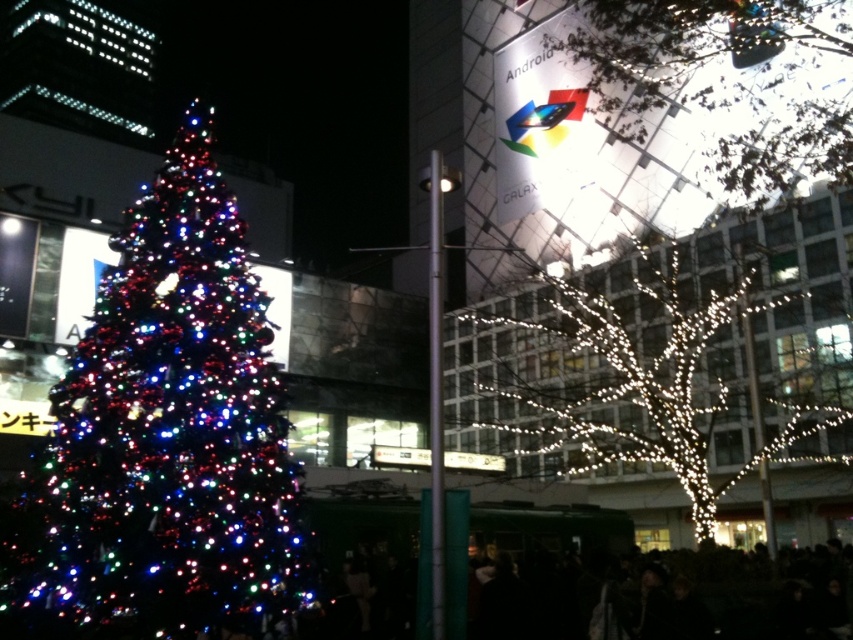
Can you confirm if multicolored lights at left is wider than illuminated wire at upper right?

Indeed, multicolored lights at left has a greater width compared to illuminated wire at upper right.

Where is `multicolored lights at left`? Image resolution: width=853 pixels, height=640 pixels. multicolored lights at left is located at coordinates (166, 435).

Is point (759, 356) in front of point (775, 8)?

That is False.

Is point (752, 458) more distant than point (795, 128)?

No, it is not.

Is point (744, 259) positioned behind point (672, 60)?

No.

At what (x,y) coordinates should I click in order to perform the action: click on illuminated wire at right. Please return your answer as a coordinate pair (x, y). Looking at the image, I should click on (668, 362).

Image resolution: width=853 pixels, height=640 pixels. What do you see at coordinates (166, 435) in the screenshot?
I see `multicolored lights at left` at bounding box center [166, 435].

Who is more forward, [254,413] or [759,364]?

Point [254,413]

Identify the location of multicolored lights at left. This screenshot has height=640, width=853. (166, 435).